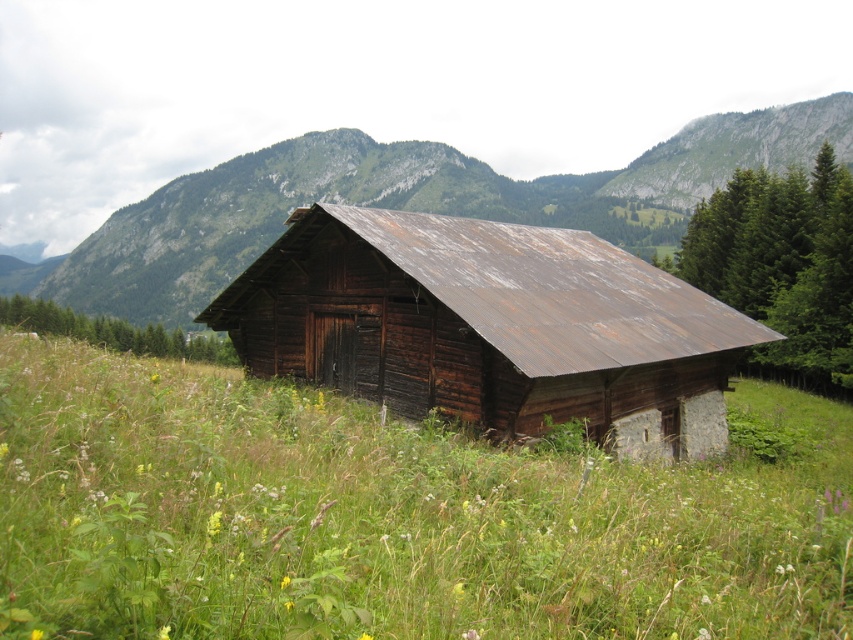
Question: Which point is farther to the camera?

Choices:
 (A) weathered wood barn at center
 (B) green grassy at center

Answer: (A)

Question: Does green grassy at center appear over weathered wood barn at center?

Choices:
 (A) no
 (B) yes

Answer: (A)

Question: Is green grassy at center wider than weathered wood barn at center?

Choices:
 (A) yes
 (B) no

Answer: (A)

Question: Among these points, which one is farthest from the camera?

Choices:
 (A) (311, 545)
 (B) (604, 355)

Answer: (B)

Question: Is green grassy at center above weathered wood barn at center?

Choices:
 (A) yes
 (B) no

Answer: (B)